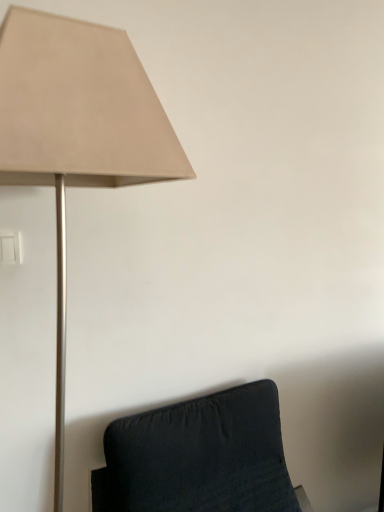
Question: Considering the positions of point (155, 141) and point (110, 468), is point (155, 141) closer or farther from the camera than point (110, 468)?

Choices:
 (A) closer
 (B) farther

Answer: (A)

Question: Considering the positions of beige fabric lampshade at upper left and velvet black cushion at lower right in the image, is beige fabric lampshade at upper left wider or thinner than velvet black cushion at lower right?

Choices:
 (A) thin
 (B) wide

Answer: (A)

Question: From a real-world perspective, is beige fabric lampshade at upper left positioned above or below velvet black cushion at lower right?

Choices:
 (A) below
 (B) above

Answer: (B)

Question: Considering their positions, is velvet black cushion at lower right located in front of or behind beige fabric lampshade at upper left?

Choices:
 (A) behind
 (B) front

Answer: (A)

Question: From a real-world perspective, is velvet black cushion at lower right physically located above or below beige fabric lampshade at upper left?

Choices:
 (A) below
 (B) above

Answer: (A)

Question: Is velvet black cushion at lower right spatially inside beige fabric lampshade at upper left, or outside of it?

Choices:
 (A) inside
 (B) outside

Answer: (B)

Question: Is velvet black cushion at lower right to the left or to the right of beige fabric lampshade at upper left in the image?

Choices:
 (A) left
 (B) right

Answer: (B)